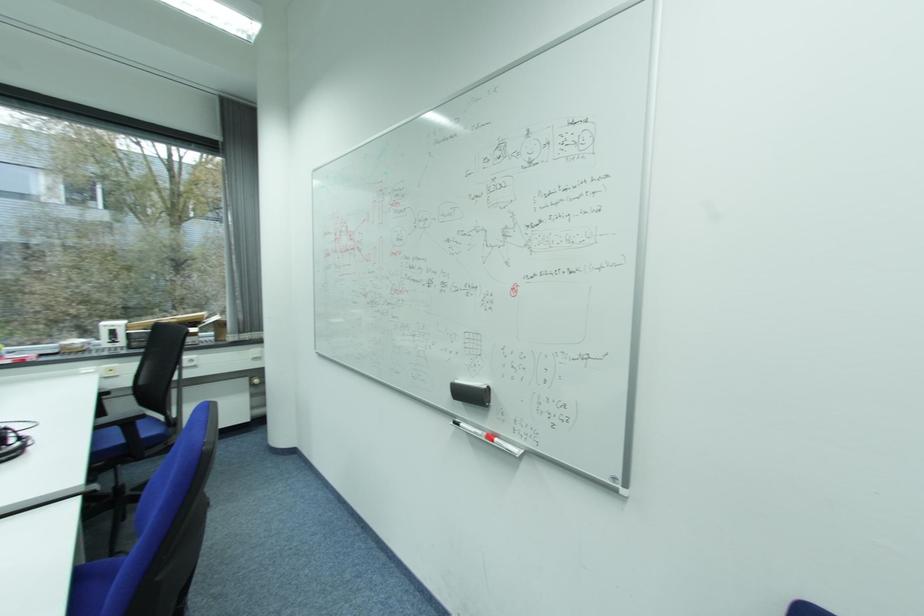
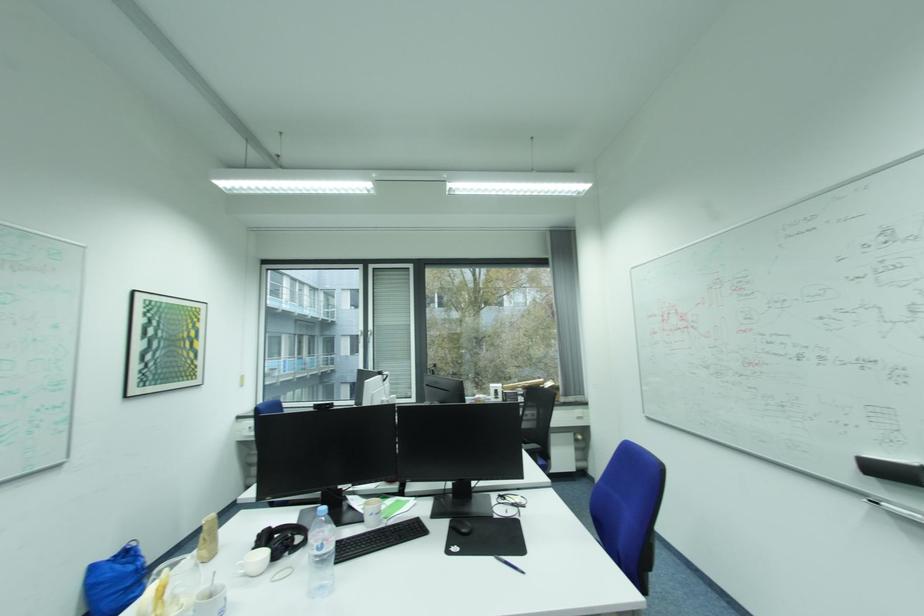
Question: The first image is from the beginning of the video and the second image is from the end. How did the camera likely rotate when shooting the video?

Choices:
 (A) Left
 (B) Right
 (C) Up
 (D) Down

Answer: (A)